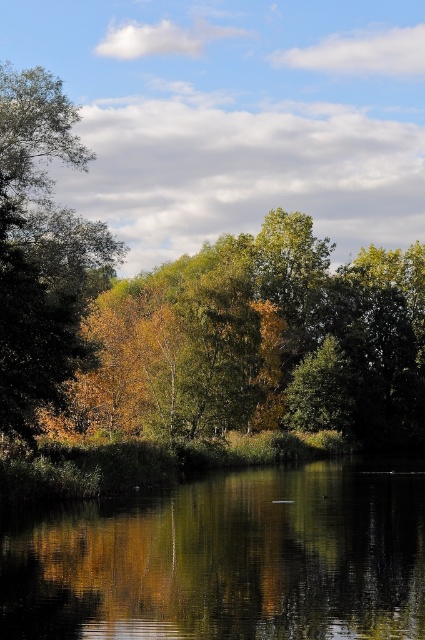
Question: Which of these objects is positioned closest to the golden yellow leaves at left?

Choices:
 (A) green reflective water at center
 (B) golden leaves at center

Answer: (B)

Question: Which point is farther to the camera?

Choices:
 (A) (19, 337)
 (B) (203, 481)
 (C) (421, 269)

Answer: (C)

Question: Does golden leaves at center have a greater width compared to green reflective water at center?

Choices:
 (A) yes
 (B) no

Answer: (A)

Question: Does golden leaves at center appear on the right side of golden yellow leaves at left?

Choices:
 (A) no
 (B) yes

Answer: (B)

Question: Does golden leaves at center have a lesser width compared to golden yellow leaves at left?

Choices:
 (A) no
 (B) yes

Answer: (A)

Question: Which of the following is the farthest from the observer?

Choices:
 (A) (323, 618)
 (B) (360, 422)

Answer: (B)